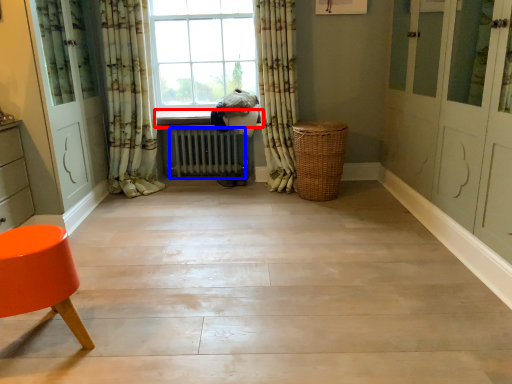
Question: Which of the following is the closest to the observer, window sill (highlighted by a red box) or radiator (highlighted by a blue box)?

Choices:
 (A) window sill
 (B) radiator

Answer: (A)